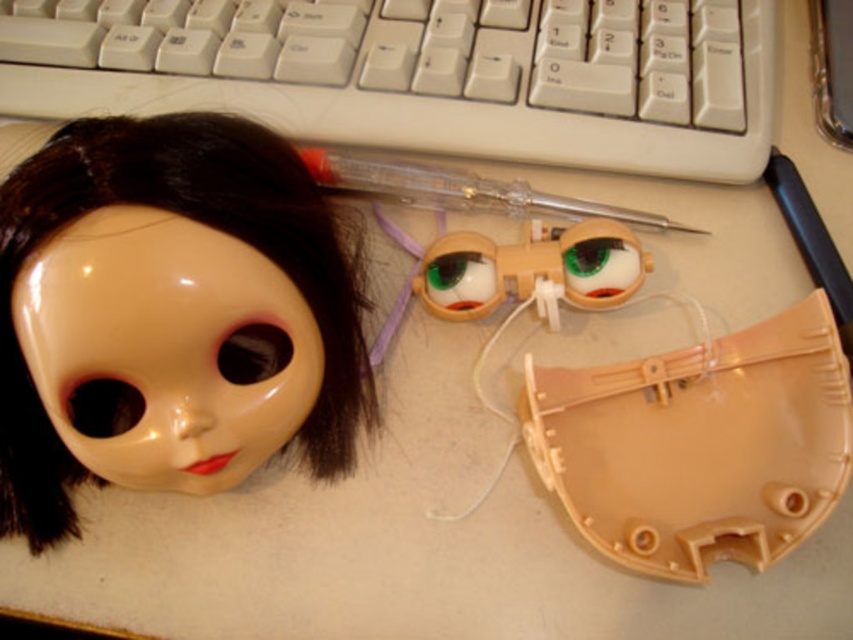
You are organizing a doll display and need to place the glossy plastic doll head at upper left. According to the coordinates provided, where exactly should you position it on the desk?

The glossy plastic doll head at upper left should be positioned at coordinates point [170,316] as specified.

From the picture: You are organizing a display of doll parts on a desk. You have a glossy plastic doll head at upper left and two detached body parts to the right. If you want to place a new accessory exactly where point (170, 316) is located, which object should you place it near?

The point (170, 316) corresponds to the glossy plastic doll head at upper left, so you should place the accessory near the glossy plastic doll head at upper left.

You are organizing a doll collection on a desk. You have a glossy plastic doll head at upper left. Where should you place it so that its center aligns with the point marked at coordinates (170, 316)?

The point at coordinates (170, 316) marks the glossy plastic doll head at upper left, so placing its center there would align it correctly.